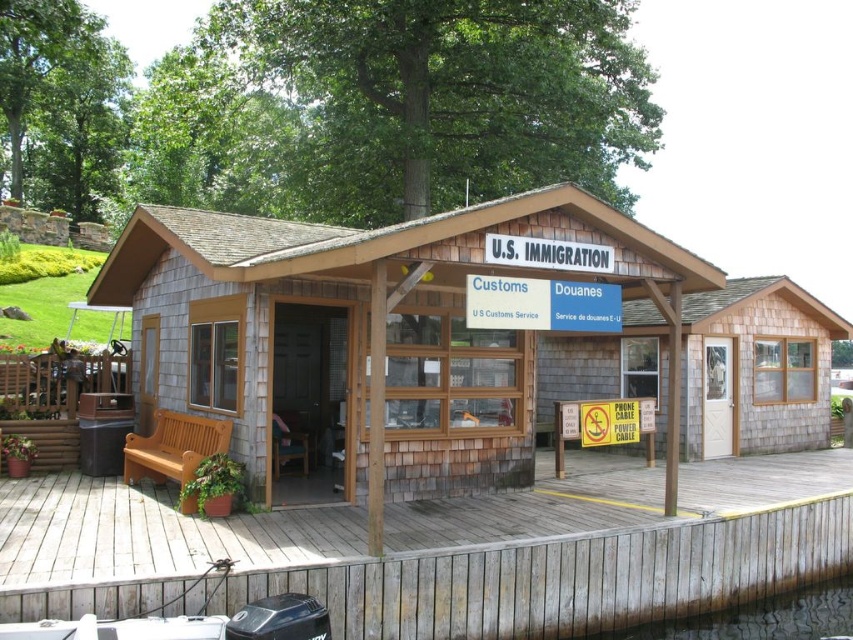
You are standing on the wooden dock and see the wooden at center and the shingled wood cabin at center. Which object is positioned to the right of the other?

The wooden at center is to the right of the shingled wood cabin at center according to the description.

You are a traveler approaching the wooden dock and see the wooden at center and the shingled wood cabin at center. Which structure is closer to you as you arrive?

The wooden at center is closer to you because it is in front of the shingled wood cabin at center.

You are standing at the entrance of the U.S. Immigration building on the dock and notice two points marked on the structure. Which point, point (x=262, y=474) or point (x=764, y=616), is closer to you?

Point (x=262, y=474) is closer to the viewer than point (x=764, y=616).